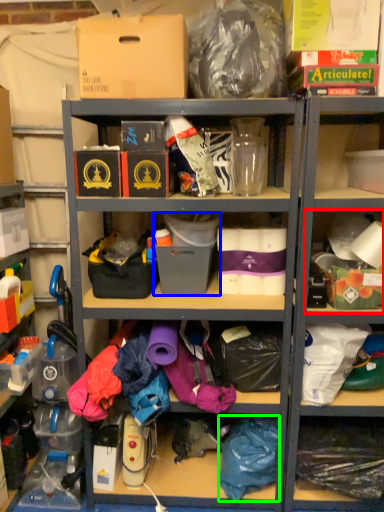
Question: Based on their relative distances, which object is nearer to shelf (highlighted by a red box)? Choose from storage box (highlighted by a blue box) and clothing (highlighted by a green box).

Choices:
 (A) storage box
 (B) clothing

Answer: (A)